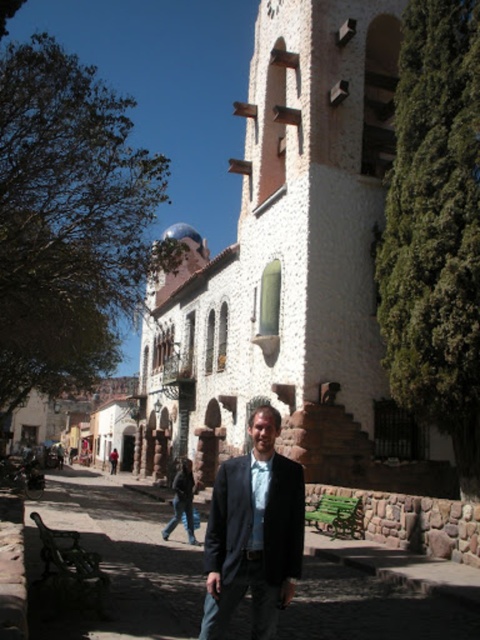
What do you see at coordinates (292, 269) in the screenshot? I see `white stucco church at center` at bounding box center [292, 269].

Can you confirm if white stucco church at center is shorter than blue silk tie at center?

In fact, white stucco church at center may be taller than blue silk tie at center.

At what (x,y) coordinates should I click in order to perform the action: click on white stucco church at center. Please return your answer as a coordinate pair (x, y). Looking at the image, I should click on (292, 269).

The width and height of the screenshot is (480, 640). Identify the location of white stucco church at center. (292, 269).

Is white stucco church at center to the right of matte black suit at center from the viewer's perspective?

Incorrect, white stucco church at center is not on the right side of matte black suit at center.

Is white stucco church at center wider than matte black suit at center?

Indeed, white stucco church at center has a greater width compared to matte black suit at center.

You are a GUI agent. You are given a task and a screenshot of the screen. Output one action in this format:
    pyautogui.click(x=<x>, y=<y>)
    Task: Click on the white stucco church at center
    This screenshot has height=640, width=480.
    Given the screenshot: What is the action you would take?
    pyautogui.click(x=292, y=269)

In order to click on white stucco church at center in this screenshot , I will do `click(292, 269)`.

Who is more forward, (277, 499) or (254, 522)?

Point (254, 522)

Does matte black suit at center appear on the left side of blue silk tie at center?

No, matte black suit at center is not to the left of blue silk tie at center.

What do you see at coordinates (253, 532) in the screenshot?
I see `matte black suit at center` at bounding box center [253, 532].

I want to click on matte black suit at center, so click(253, 532).